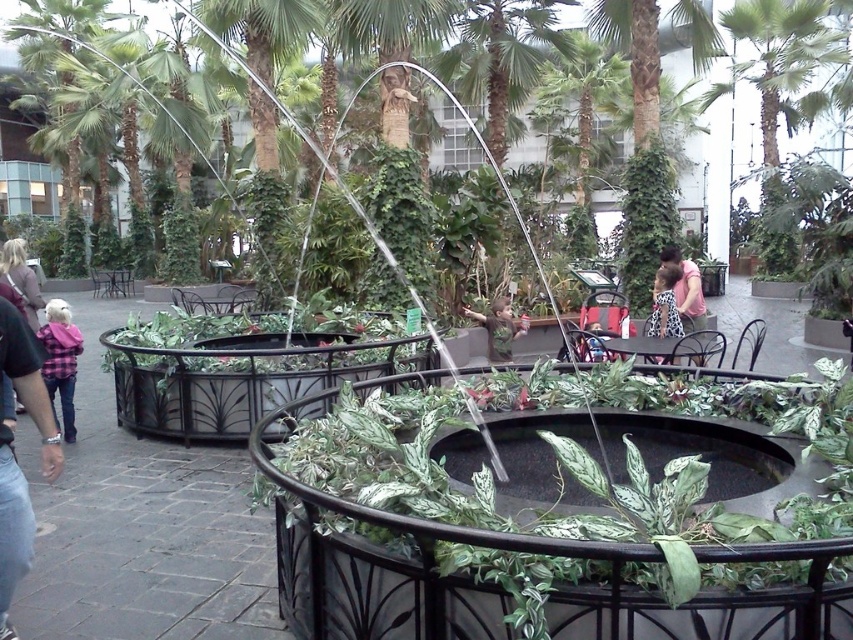
You are a photographer standing in the vibrant indoor garden. You want to take a photo of the matte black jacket at left and the matte pink shirt at center so that both are clearly visible in the frame. Given that your camera has a maximum focus range of 7 meters, will you be able to capture both objects in sharp focus at the same time?

The matte black jacket at left and matte pink shirt at center are 6.93 meters apart. Since the distance between them is within the camera maximum focus range of 7 meters, you can capture both objects in sharp focus at the same time.